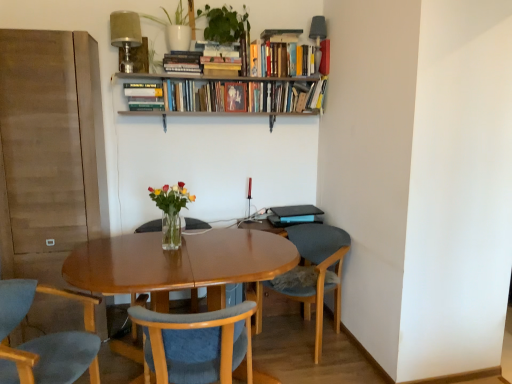
Question: Which is correct: hardcover books at upper center, which is the 2th book in right-to-left order, is inside hardcover book at upper center, the sixth book from the left, or outside of it?

Choices:
 (A) inside
 (B) outside

Answer: (B)

Question: Considering the positions of point (311, 44) and point (326, 69), is point (311, 44) closer or farther from the camera than point (326, 69)?

Choices:
 (A) farther
 (B) closer

Answer: (B)

Question: Estimate the real-world distances between objects in this image. Which object is farther from the green matte plant at upper center?

Choices:
 (A) hardcover books at upper center, the 3th book in the right-to-left sequence
 (B) hardcover book at upper center, the sixth book from the left
 (C) hardcover book at upper center, which is the 6th book in right-to-left order
 (D) matte black photo frame at upper center, the third book in the left-to-right sequence
 (E) hardcover books at upper center, which is the 2th book in right-to-left order

Answer: (B)

Question: Considering the real-world distances, which object is farthest from the green matte plant at upper center?

Choices:
 (A) satin beige lampshade at upper center
 (B) matte black photo frame at upper center, which is counted as the fourth book, starting from the right
 (C) hardcover books at upper center, the 2th book in the left-to-right sequence
 (D) clear glass vase at center
 (E) hardcover books at upper center, acting as the 5th book starting from the left

Answer: (D)